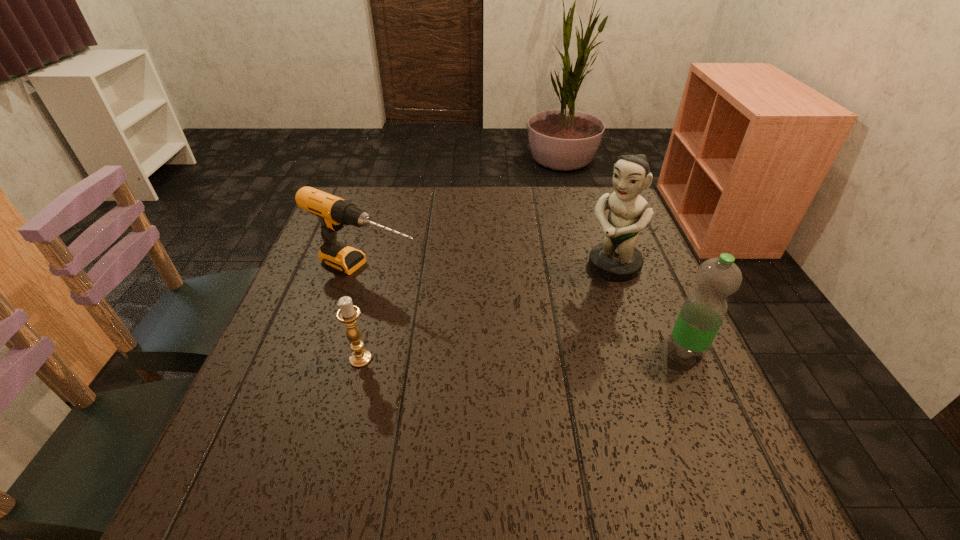
Find the location of a particular element. This screenshot has height=540, width=960. candle holder is located at coordinates point(348,313).

Identify the location of the third shortest object. This screenshot has width=960, height=540. click(704, 309).

The height and width of the screenshot is (540, 960). In order to click on drill in this screenshot , I will do `click(334, 212)`.

The width and height of the screenshot is (960, 540). I want to click on the tallest object, so click(x=616, y=258).

At what (x,y) coordinates should I click in order to perform the action: click on free space located on the front of the shortest object. Please return your answer as a coordinate pair (x, y). This screenshot has width=960, height=540. Looking at the image, I should click on (x=343, y=427).

I want to click on vacant area situated on the back of the third shortest object, so click(x=639, y=242).

The image size is (960, 540). I want to click on blank space located 0.290m on the handle side of the third tallest object, so click(518, 330).

Identify the location of vacant region located on the handle side of the third tallest object. (511, 327).

Find the location of a particular element. This screenshot has width=960, height=540. vacant space located 0.300m on the handle side of the third tallest object is located at coordinates point(523,332).

This screenshot has height=540, width=960. I want to click on free space located on the front-facing side of the tallest object, so click(526, 336).